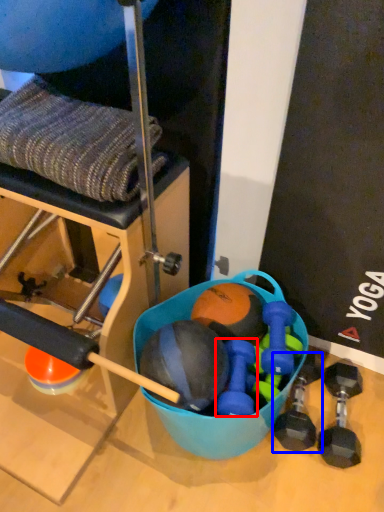
Question: Which point is further to the camera, dumbbell (highlighted by a red box) or dumbbell (highlighted by a blue box)?

Choices:
 (A) dumbbell
 (B) dumbbell

Answer: (B)